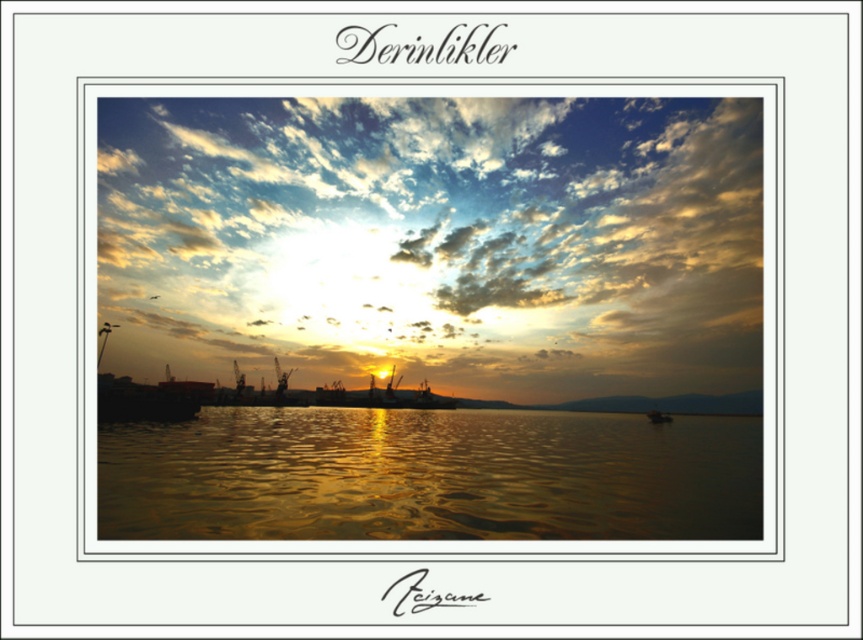
You are a photographer planning to capture the sunset scene. You want to ensure the metallic silver boat at center is clearly visible in front of the cloudy sky at upper center. Based on the scene, is this possible?

The metallic silver boat at center is behind cloudy sky at upper center, so it cannot be seen in front of it. Adjust your position or angle to frame the boat in a different part of the scene where it can be positioned in front of the sky.

You are a photographer planning to capture the sunset scene. You want to ensure that the golden reflective water at center and the metallic silver boat at center are both visible in your shot. Given that your camera has a fixed focal length, which object should you position closer to the edge of the frame to include both?

Since the golden reflective water at center is wider than the metallic silver boat at center, positioning the metallic silver boat at center closer to the edge of the frame would allow both objects to fit within the shot while accommodating the wider golden reflective water at center.